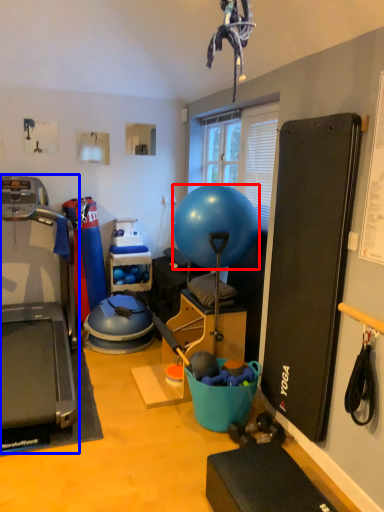
Question: Which object is further to the camera taking this photo, ball (highlighted by a red box) or treadmill (highlighted by a blue box)?

Choices:
 (A) ball
 (B) treadmill

Answer: (A)